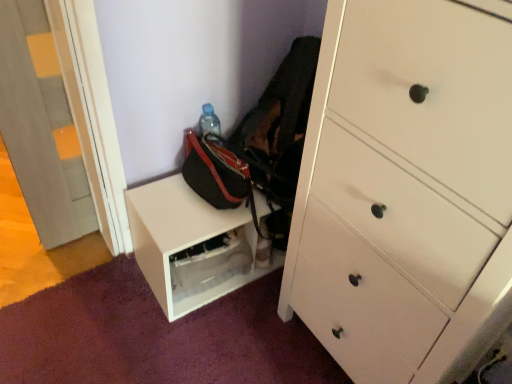
Question: From the image's perspective, is black fabric messenger bag at lower center beneath white matte shelf at lower center?

Choices:
 (A) no
 (B) yes

Answer: (A)

Question: Can you confirm if black fabric messenger bag at lower center is positioned to the right of white matte shelf at lower center?

Choices:
 (A) no
 (B) yes

Answer: (B)

Question: Can you confirm if black fabric messenger bag at lower center is shorter than white matte shelf at lower center?

Choices:
 (A) no
 (B) yes

Answer: (B)

Question: Is black fabric messenger bag at lower center further to the viewer compared to white matte shelf at lower center?

Choices:
 (A) yes
 (B) no

Answer: (B)

Question: Is black fabric messenger bag at lower center taller than white matte shelf at lower center?

Choices:
 (A) yes
 (B) no

Answer: (B)

Question: From the image's perspective, is black fabric messenger bag at lower center located above or below matte gray door at left?

Choices:
 (A) above
 (B) below

Answer: (B)

Question: In terms of size, does black fabric messenger bag at lower center appear bigger or smaller than matte gray door at left?

Choices:
 (A) small
 (B) big

Answer: (B)

Question: Considering their positions, is black fabric messenger bag at lower center located in front of or behind matte gray door at left?

Choices:
 (A) behind
 (B) front

Answer: (A)

Question: In terms of height, does black fabric messenger bag at lower center look taller or shorter compared to matte gray door at left?

Choices:
 (A) short
 (B) tall

Answer: (A)

Question: Is point (415, 6) positioned closer to the camera than point (211, 256)?

Choices:
 (A) closer
 (B) farther

Answer: (A)

Question: Choose the correct answer: Is white wood chest of drawers at right inside white matte shelf at lower center or outside it?

Choices:
 (A) inside
 (B) outside

Answer: (B)

Question: Is white wood chest of drawers at right to the left or to the right of white matte shelf at lower center in the image?

Choices:
 (A) left
 (B) right

Answer: (B)

Question: Is white wood chest of drawers at right taller or shorter than white matte shelf at lower center?

Choices:
 (A) tall
 (B) short

Answer: (A)

Question: Looking at the image, does white matte shelf at lower center seem bigger or smaller compared to matte gray door at left?

Choices:
 (A) small
 (B) big

Answer: (B)

Question: From the image's perspective, is white matte shelf at lower center positioned above or below matte gray door at left?

Choices:
 (A) below
 (B) above

Answer: (A)